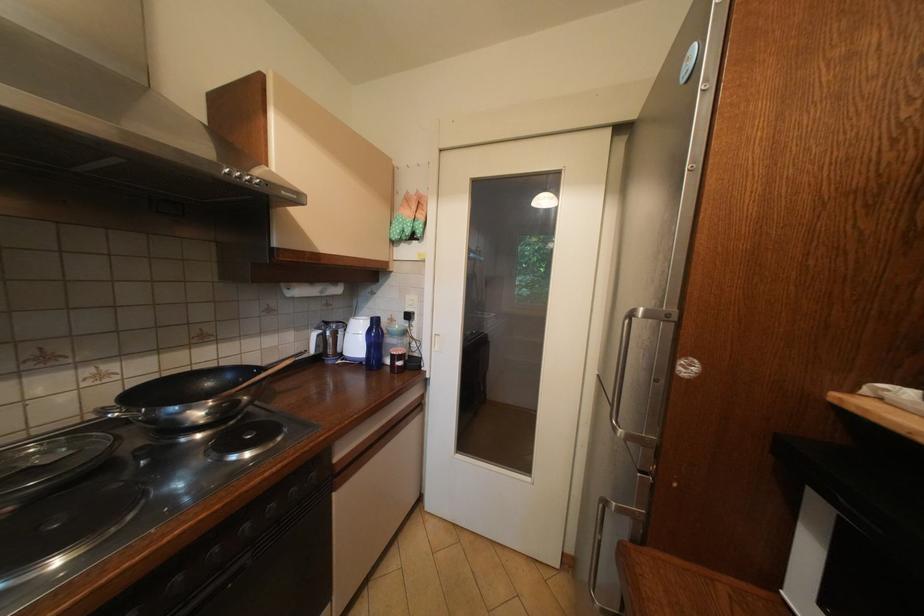
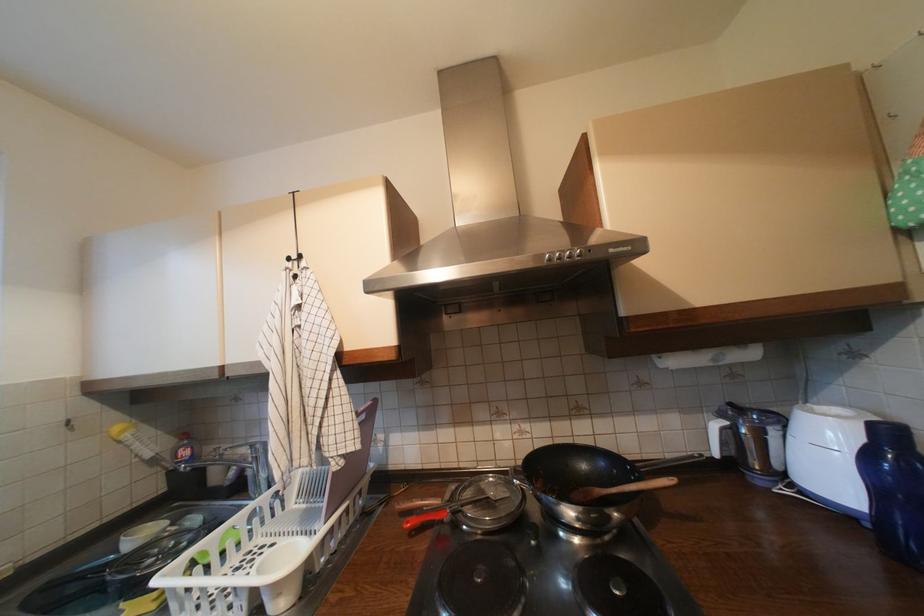
Find the pixel in the second image that matches (256,182) in the first image.

(577, 257)